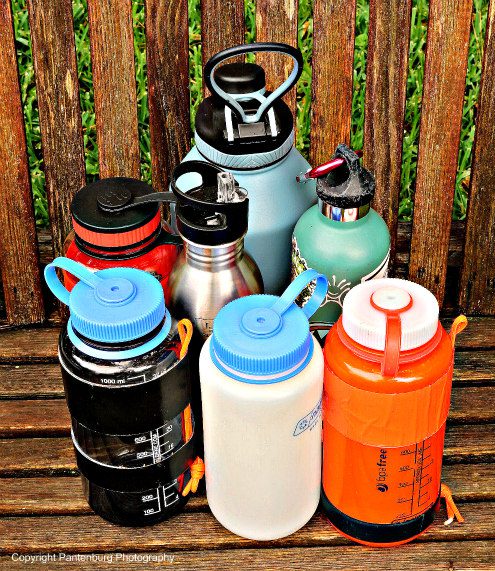
Find the location of a particular element. This screenshot has width=495, height=571. thermoses is located at coordinates pos(266,172), pos(129,227), pos(120,329), pos(206,225), pos(263,333), pos(357,251), pos(402,325).